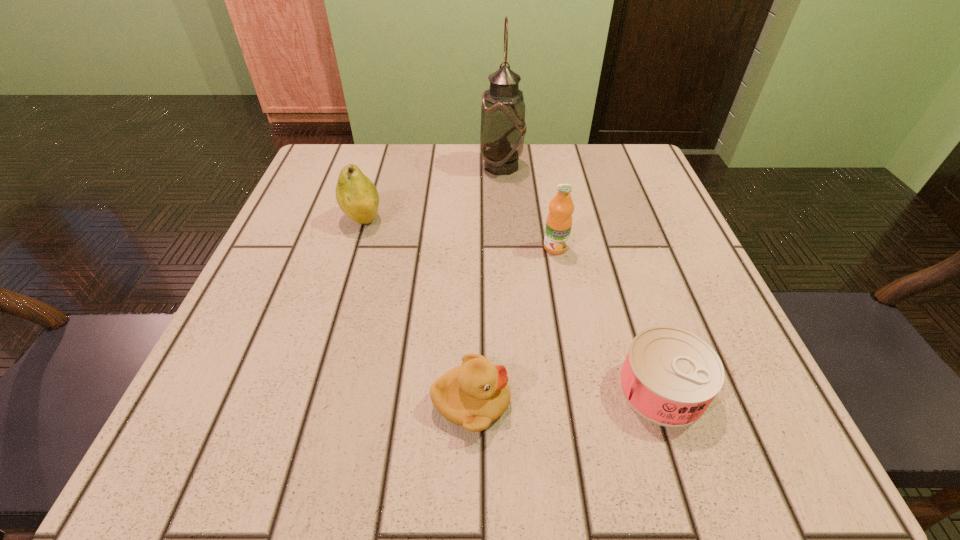
You are a GUI agent. You are given a task and a screenshot of the screen. Output one action in this format:
    pyautogui.click(x=<x>, y=<y>)
    Task: Click on the vacant region located 0.060m on the front of the pear
    
    Given the screenshot: What is the action you would take?
    pyautogui.click(x=350, y=258)

You are a GUI agent. You are given a task and a screenshot of the screen. Output one action in this format:
    pyautogui.click(x=<x>, y=<y>)
    Task: Click on the vacant space located 0.130m on the label of the orange juice
    
    Given the screenshot: What is the action you would take?
    pyautogui.click(x=567, y=310)

The width and height of the screenshot is (960, 540). I want to click on free region located at the beak of the fourth tallest object, so click(x=631, y=402).

You are a GUI agent. You are given a task and a screenshot of the screen. Output one action in this format:
    pyautogui.click(x=<x>, y=<y>)
    Task: Click on the vacant area located on the back of the can
    The image size is (960, 540).
    Given the screenshot: What is the action you would take?
    pyautogui.click(x=599, y=198)

Identify the location of object that is at the far edge. (503, 127).

This screenshot has height=540, width=960. Identify the location of duckling present at the near edge. (473, 395).

This screenshot has height=540, width=960. In order to click on can present at the near edge in this screenshot , I will do `click(670, 376)`.

At what (x,y) coordinates should I click in order to perform the action: click on object present at the left edge. Please return your answer as a coordinate pair (x, y). This screenshot has width=960, height=540. Looking at the image, I should click on (356, 195).

Image resolution: width=960 pixels, height=540 pixels. Identify the location of object at the right edge. (670, 376).

Identify the location of object that is at the near right corner. The width and height of the screenshot is (960, 540). (670, 376).